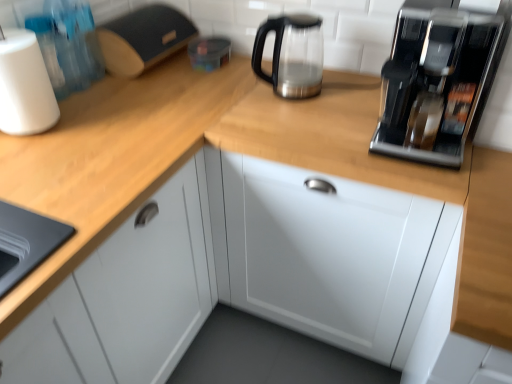
Where is `vacant area that is situated to the right of satin metallic kettle at upper center`? The width and height of the screenshot is (512, 384). vacant area that is situated to the right of satin metallic kettle at upper center is located at coordinates (346, 86).